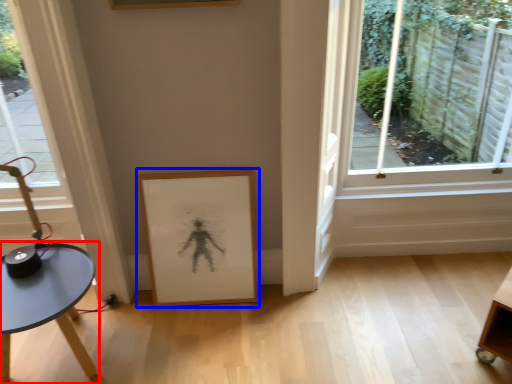
Question: Which object appears closest to the camera in this image, table (highlighted by a red box) or picture frame (highlighted by a blue box)?

Choices:
 (A) table
 (B) picture frame

Answer: (A)